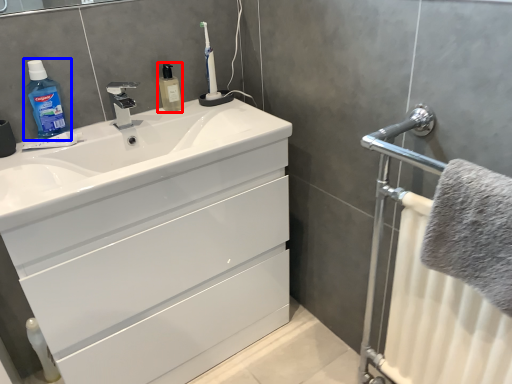
Question: Which of the following is the closest to the observer, mouthwash (highlighted by a red box) or cleaning product (highlighted by a blue box)?

Choices:
 (A) mouthwash
 (B) cleaning product

Answer: (B)